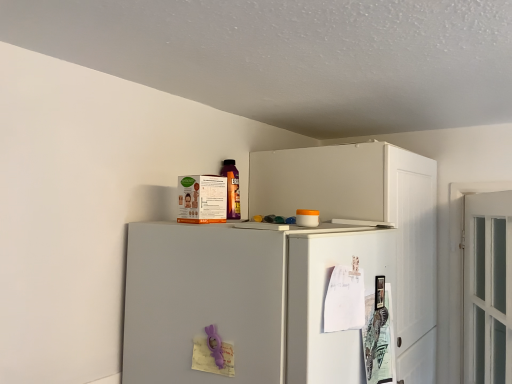
Question: Considering the relative sizes of white glass door at right, the first door viewed from the right, and white paper at upper right, the 2th door viewed from the right, in the image provided, is white glass door at right, the first door viewed from the right, bigger than white paper at upper right, the 2th door viewed from the right,?

Choices:
 (A) no
 (B) yes

Answer: (B)

Question: From a real-world perspective, is white glass door at right, the first door viewed from the right, over white paper at upper right, the 2th door viewed from the right?

Choices:
 (A) no
 (B) yes

Answer: (A)

Question: Is white glass door at right, the first door viewed from the right, at the left side of white paper at upper right, the 2th door viewed from the right?

Choices:
 (A) no
 (B) yes

Answer: (A)

Question: Considering the relative positions of white glass door at right, the first door viewed from the right, and white paper at upper right, placed as the 1th door when sorted from left to right, in the image provided, is white glass door at right, the first door viewed from the right, behind white paper at upper right, placed as the 1th door when sorted from left to right,?

Choices:
 (A) no
 (B) yes

Answer: (B)

Question: Does white glass door at right, which appears as the second door when viewed from the left, appear on the right side of white paper at upper right, the 2th door viewed from the right?

Choices:
 (A) yes
 (B) no

Answer: (A)

Question: Is white glass door at right, which appears as the second door when viewed from the left, oriented towards white paper at upper right, placed as the 1th door when sorted from left to right?

Choices:
 (A) no
 (B) yes

Answer: (A)

Question: Is the depth of white paper at upper right, the 2th door viewed from the right, less than that of white glass door at right, the first door viewed from the right?

Choices:
 (A) no
 (B) yes

Answer: (B)

Question: Can you confirm if white paper at upper right, the 2th door viewed from the right, is bigger than white glass door at right, which appears as the second door when viewed from the left?

Choices:
 (A) yes
 (B) no

Answer: (B)

Question: Is white paper at upper right, placed as the 1th door when sorted from left to right, oriented towards white glass door at right, which appears as the second door when viewed from the left?

Choices:
 (A) yes
 (B) no

Answer: (B)

Question: Does white paper at upper right, placed as the 1th door when sorted from left to right, appear on the right side of white glass door at right, which appears as the second door when viewed from the left?

Choices:
 (A) yes
 (B) no

Answer: (B)

Question: Does white paper at upper right, placed as the 1th door when sorted from left to right, have a greater height compared to white glass door at right, which appears as the second door when viewed from the left?

Choices:
 (A) yes
 (B) no

Answer: (B)

Question: From a real-world perspective, is white paper at upper right, placed as the 1th door when sorted from left to right, positioned under white glass door at right, which appears as the second door when viewed from the left, based on gravity?

Choices:
 (A) yes
 (B) no

Answer: (B)

Question: Is white matte refrigerator at upper center wider than white paper at upper right, placed as the 1th door when sorted from left to right?

Choices:
 (A) yes
 (B) no

Answer: (A)